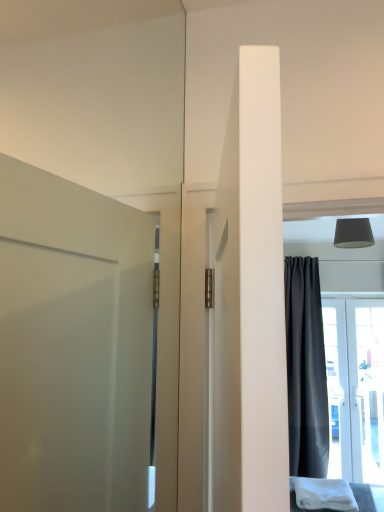
Question: Is white soft cloth at lower right located outside dark gray matte curtain at right?

Choices:
 (A) no
 (B) yes

Answer: (B)

Question: Considering the relative sizes of white soft cloth at lower right and dark gray matte curtain at right in the image provided, is white soft cloth at lower right thinner than dark gray matte curtain at right?

Choices:
 (A) no
 (B) yes

Answer: (A)

Question: Is white soft cloth at lower right shorter than dark gray matte curtain at right?

Choices:
 (A) yes
 (B) no

Answer: (A)

Question: Does white soft cloth at lower right have a greater height compared to dark gray matte curtain at right?

Choices:
 (A) yes
 (B) no

Answer: (B)

Question: Is the position of white soft cloth at lower right more distant than that of dark gray matte curtain at right?

Choices:
 (A) no
 (B) yes

Answer: (A)

Question: From a real-world perspective, is matte gray lampshade at upper right above or below white soft cloth at lower right?

Choices:
 (A) above
 (B) below

Answer: (A)

Question: Considering their positions, is matte gray lampshade at upper right located in front of or behind white soft cloth at lower right?

Choices:
 (A) front
 (B) behind

Answer: (A)

Question: Is matte gray lampshade at upper right spatially inside white soft cloth at lower right, or outside of it?

Choices:
 (A) outside
 (B) inside

Answer: (A)

Question: Is matte gray lampshade at upper right bigger or smaller than white soft cloth at lower right?

Choices:
 (A) small
 (B) big

Answer: (B)

Question: From a real-world perspective, is white soft cloth at lower right positioned above or below matte gray lampshade at upper right?

Choices:
 (A) below
 (B) above

Answer: (A)

Question: Based on their sizes in the image, would you say white soft cloth at lower right is bigger or smaller than matte gray lampshade at upper right?

Choices:
 (A) small
 (B) big

Answer: (A)

Question: Considering the positions of white soft cloth at lower right and matte gray lampshade at upper right in the image, is white soft cloth at lower right wider or thinner than matte gray lampshade at upper right?

Choices:
 (A) wide
 (B) thin

Answer: (A)

Question: Is white soft cloth at lower right to the left or to the right of matte gray lampshade at upper right in the image?

Choices:
 (A) left
 (B) right

Answer: (A)

Question: Is point (329, 497) positioned closer to the camera than point (306, 414)?

Choices:
 (A) closer
 (B) farther

Answer: (A)

Question: Considering their positions, is white soft cloth at lower right located in front of or behind dark gray matte curtain at right?

Choices:
 (A) behind
 (B) front

Answer: (B)